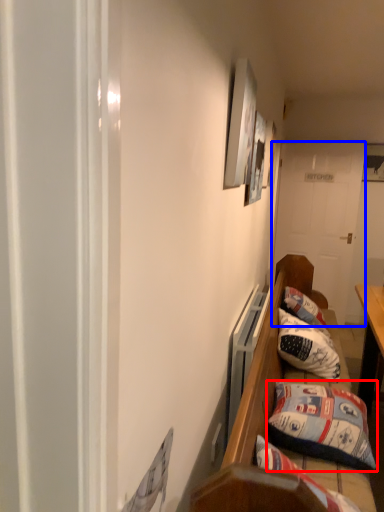
Question: Which object is closer to the camera taking this photo, pillow (highlighted by a red box) or door (highlighted by a blue box)?

Choices:
 (A) pillow
 (B) door

Answer: (A)